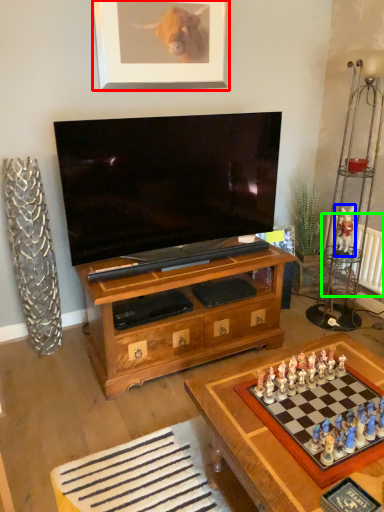
Question: Which is nearer to the picture frame (highlighted by a red box)? toy (highlighted by a blue box) or radiator (highlighted by a green box).

Choices:
 (A) toy
 (B) radiator

Answer: (A)